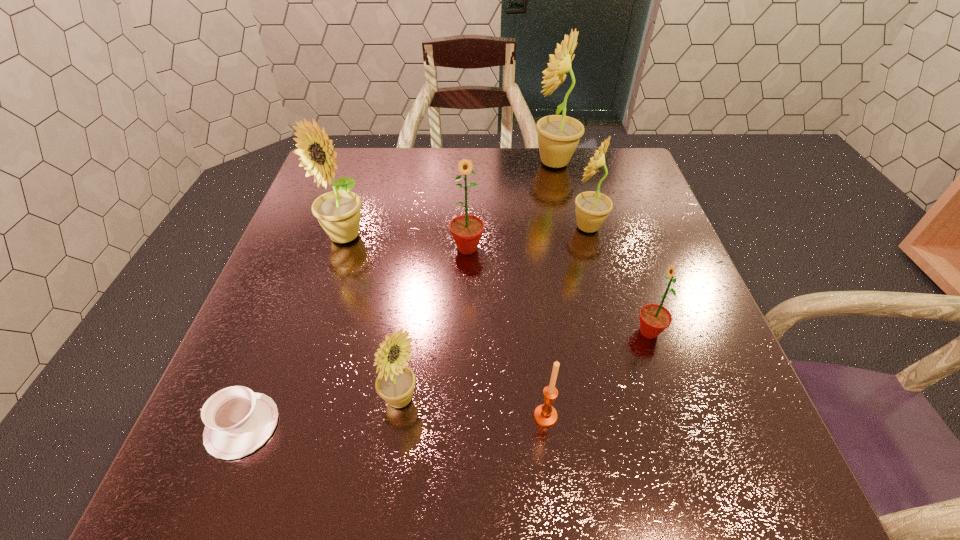
Find the location of a particular element. The image size is (960, 540). the nearer green sunflower is located at coordinates (654, 319).

Identify the location of the fourth object from right to left. This screenshot has height=540, width=960. (545, 415).

Find the location of a particular element. This screenshot has width=960, height=540. the shortest object is located at coordinates (238, 421).

In order to click on free region located on the face of the tallest sunflower in this screenshot , I will do `click(468, 163)`.

Locate an element on the screen. This screenshot has height=540, width=960. free space located on the face of the tallest sunflower is located at coordinates (427, 163).

Where is `vacant space located on the face of the tallest sunflower`? The image size is (960, 540). vacant space located on the face of the tallest sunflower is located at coordinates (434, 163).

This screenshot has height=540, width=960. Find the location of `free point located on the face of the second tallest sunflower`. free point located on the face of the second tallest sunflower is located at coordinates (314, 329).

Locate an element on the screen. This screenshot has width=960, height=540. free space located on the face of the third biggest yellow sunflower is located at coordinates (421, 227).

Locate an element on the screen. This screenshot has height=540, width=960. vacant region located 0.330m on the face of the third biggest yellow sunflower is located at coordinates (434, 227).

Image resolution: width=960 pixels, height=540 pixels. What are the coordinates of `vacant area located on the face of the third biggest yellow sunflower` in the screenshot? It's located at (544, 227).